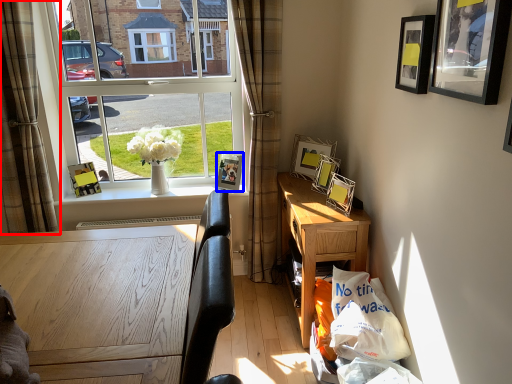
Question: Which of the following is the farthest to the observer, curtain (highlighted by a red box) or picture frame (highlighted by a blue box)?

Choices:
 (A) curtain
 (B) picture frame

Answer: (B)